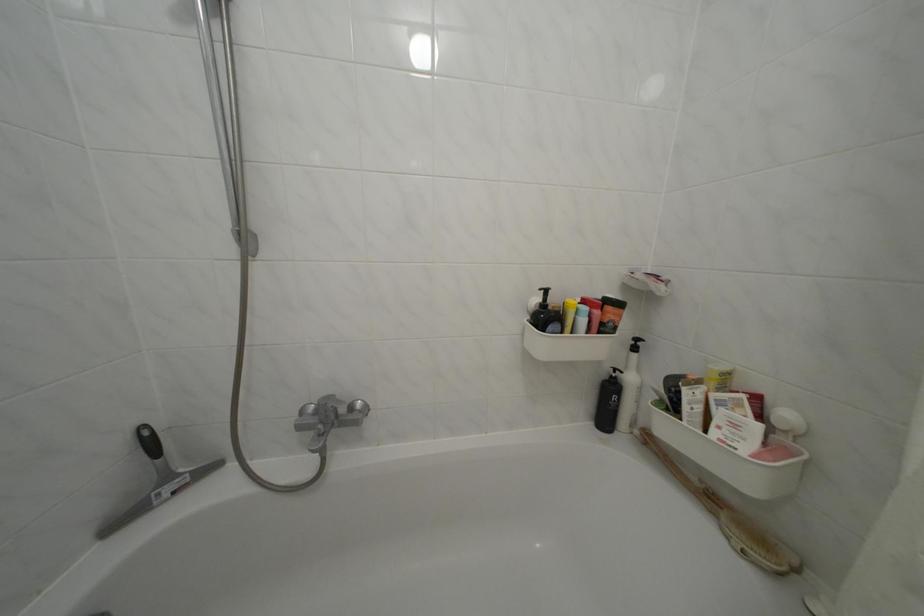
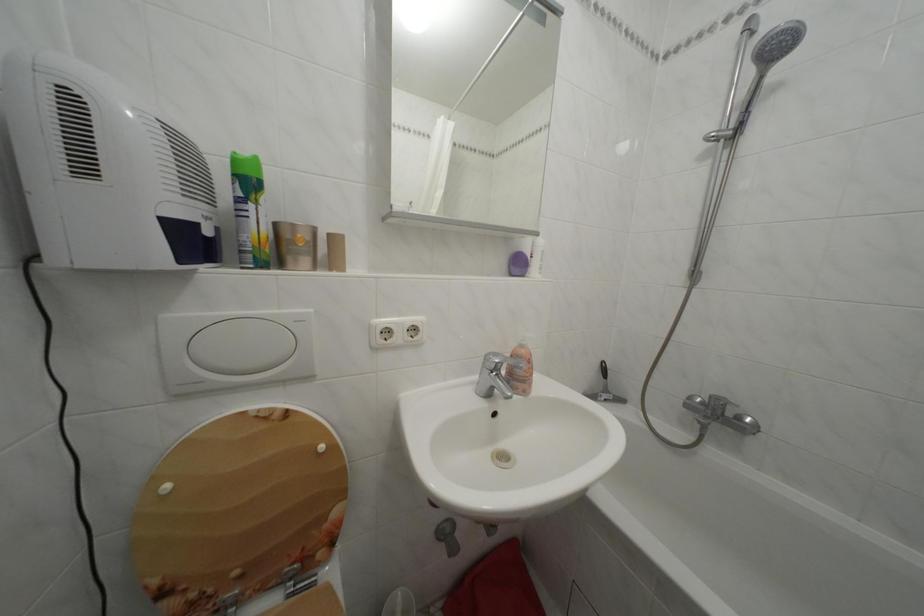
The point at (176, 484) is marked in the first image. Where is the corresponding point in the second image?

(614, 397)